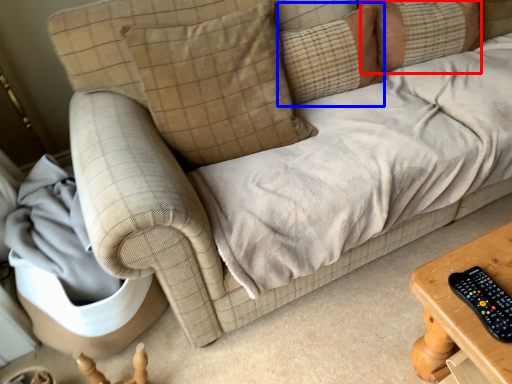
Question: Which object is further to the camera taking this photo, pillow (highlighted by a red box) or pillow (highlighted by a blue box)?

Choices:
 (A) pillow
 (B) pillow

Answer: (A)